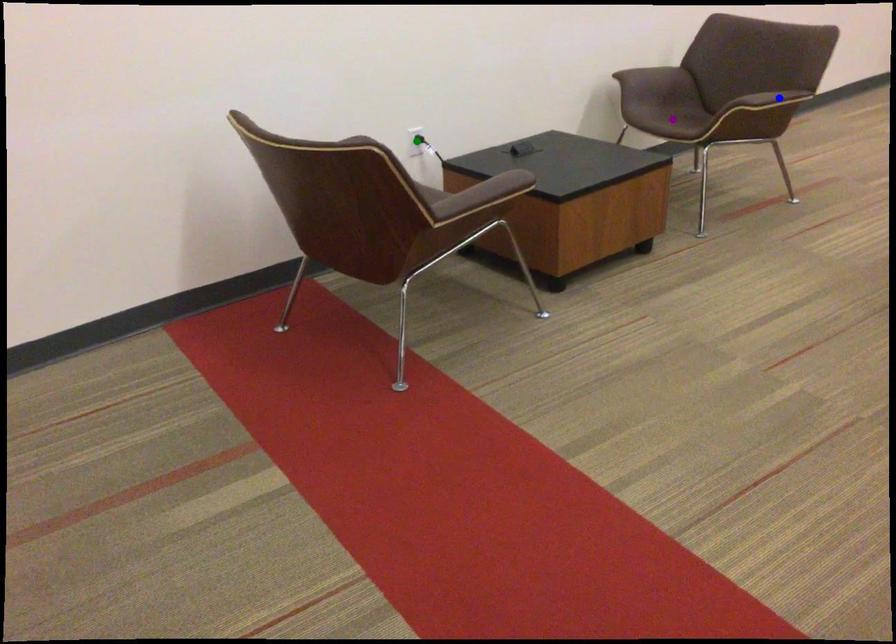
Order these from farthest to nearest:
green point | purple point | blue point

purple point → blue point → green point